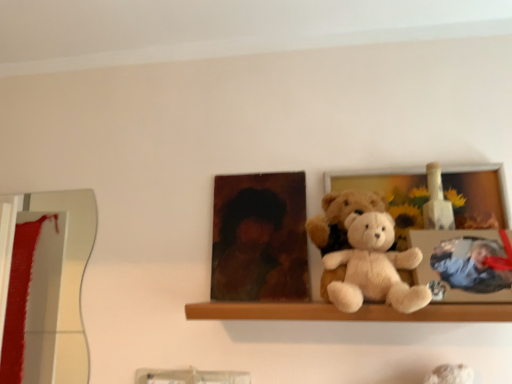
Question: From their relative heights in the image, would you say matte brown portrait at center is taller or shorter than wooden photo frame at center?

Choices:
 (A) tall
 (B) short

Answer: (B)

Question: Visually, is matte brown portrait at center positioned to the left or to the right of wooden photo frame at center?

Choices:
 (A) left
 (B) right

Answer: (A)

Question: Which object is the farthest from the white plush teddy bear at center, arranged as the second teddy bear when viewed from the back?

Choices:
 (A) matte brown portrait at center
 (B) wooden photo frame at center
 (C) wooden shelf at center
 (D) fluffy beige teddy bear at center, arranged as the first teddy bear when viewed from the back

Answer: (A)

Question: Considering the real-world distances, which object is closest to the wooden photo frame at center?

Choices:
 (A) matte brown portrait at center
 (B) wooden shelf at center
 (C) fluffy beige teddy bear at center, arranged as the first teddy bear when viewed from the back
 (D) white plush teddy bear at center, which ranks as the 1th teddy bear in front-to-back order

Answer: (C)